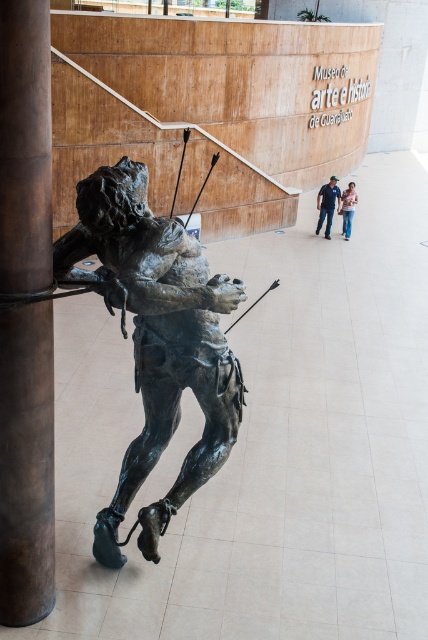
How distant is brown polished wood pillar at left from jeans at center?

They are 10.22 meters apart.

Where is `brown polished wood pillar at left`? The height and width of the screenshot is (640, 428). brown polished wood pillar at left is located at coordinates (26, 465).

Image resolution: width=428 pixels, height=640 pixels. What are the coordinates of `brown polished wood pillar at left` in the screenshot? It's located at (26, 465).

Can you confirm if bronze statue at center is positioned above jeans at center?

Actually, bronze statue at center is below jeans at center.

What are the coordinates of `bronze statue at center` in the screenshot? It's located at (157, 340).

Between point (151, 435) and point (341, 232), which one is positioned behind?

Positioned behind is point (341, 232).

At what (x,y) coordinates should I click in order to perform the action: click on bronze statue at center. Please return your answer as a coordinate pair (x, y). The image size is (428, 640). Looking at the image, I should click on (157, 340).

Is blue denim jeans at lower center smaller than jeans at center?

No, blue denim jeans at lower center is not smaller than jeans at center.

This screenshot has width=428, height=640. What are the coordinates of `blue denim jeans at lower center` in the screenshot? It's located at (326, 204).

Where is `blue denim jeans at lower center`? blue denim jeans at lower center is located at coordinates (326, 204).